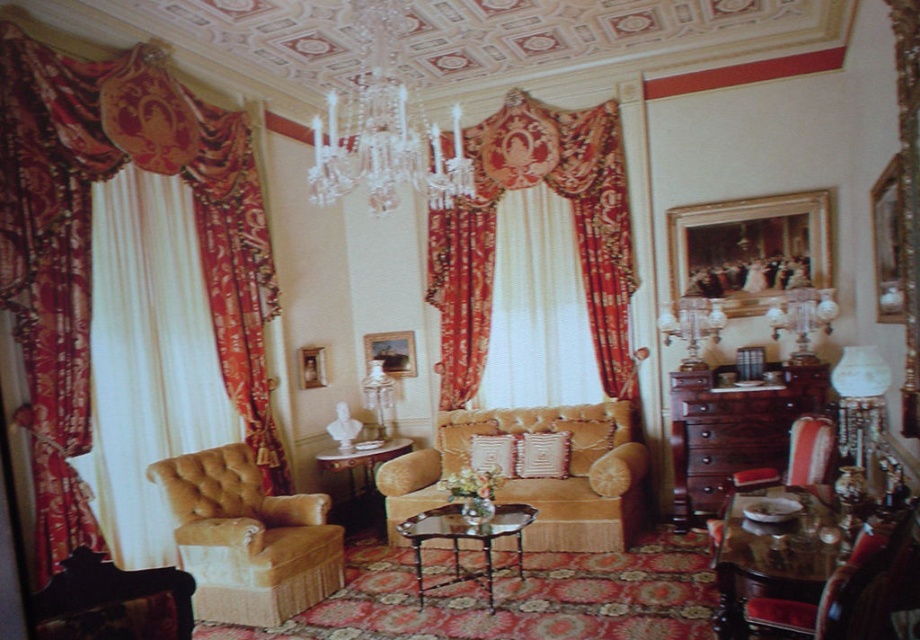
You are an interior designer assessing the space between the velvet drapery at left and the velvet red armchair at lower right. Can you determine which object is wider based on their dimensions?

The velvet drapery at left is wider than the velvet red armchair at lower right according to their dimensions.

You are an interior designer planning to install a new lighting fixture in the living room. You see the velvet drapery at center and the crystal glass chandelier at upper center. Based on their positions, which object is closer to the ceiling?

The crystal glass chandelier at upper center is closer to the ceiling because it is positioned above the velvet drapery at center.

You are standing in the formal living room and want to hang a new painting above the crystal glass chandelier at upper center. However, there is a velvet drapery at center in the way. Can you hang the painting directly above the chandelier without moving the drapery?

The crystal glass chandelier at upper center is behind the velvet drapery at center, so you cannot hang the painting directly above the chandelier without moving the drapery because the drapery is in front of it.